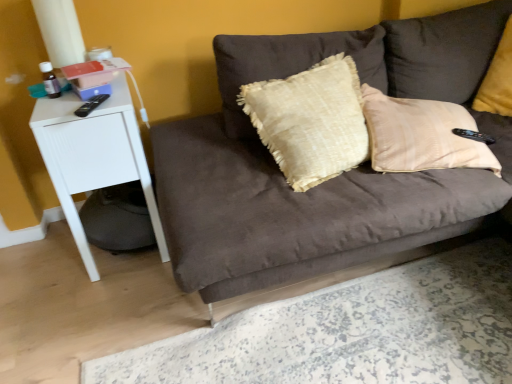
Question: Is suede brown couch at center surrounding white matte side table at left?

Choices:
 (A) yes
 (B) no

Answer: (B)

Question: Considering the relative sizes of suede brown couch at center and white matte side table at left in the image provided, is suede brown couch at center bigger than white matte side table at left?

Choices:
 (A) yes
 (B) no

Answer: (A)

Question: Is suede brown couch at center smaller than white matte side table at left?

Choices:
 (A) no
 (B) yes

Answer: (A)

Question: Is suede brown couch at center taller than white matte side table at left?

Choices:
 (A) yes
 (B) no

Answer: (B)

Question: Is suede brown couch at center oriented away from white matte side table at left?

Choices:
 (A) no
 (B) yes

Answer: (A)

Question: Considering their positions, is suede brown couch at center located in front of or behind white matte side table at left?

Choices:
 (A) front
 (B) behind

Answer: (A)

Question: From a real-world perspective, is suede brown couch at center physically located above or below white matte side table at left?

Choices:
 (A) below
 (B) above

Answer: (B)

Question: Is suede brown couch at center wider or thinner than white matte side table at left?

Choices:
 (A) wide
 (B) thin

Answer: (A)

Question: Is point (181, 279) closer or farther from the camera than point (137, 144)?

Choices:
 (A) farther
 (B) closer

Answer: (B)

Question: Relative to suede brown couch at center, is velvet yellow pillow at upper right in front or behind?

Choices:
 (A) front
 (B) behind

Answer: (B)

Question: Considering the positions of velvet yellow pillow at upper right and suede brown couch at center in the image, is velvet yellow pillow at upper right taller or shorter than suede brown couch at center?

Choices:
 (A) short
 (B) tall

Answer: (A)

Question: Choose the correct answer: Is velvet yellow pillow at upper right inside suede brown couch at center or outside it?

Choices:
 (A) outside
 (B) inside

Answer: (B)

Question: From a real-world perspective, is velvet yellow pillow at upper right positioned above or below suede brown couch at center?

Choices:
 (A) below
 (B) above

Answer: (B)

Question: Based on their positions, is suede brown couch at center located to the left or right of velvet yellow pillow at upper right?

Choices:
 (A) right
 (B) left

Answer: (B)

Question: Considering the positions of suede brown couch at center and velvet yellow pillow at upper right in the image, is suede brown couch at center wider or thinner than velvet yellow pillow at upper right?

Choices:
 (A) wide
 (B) thin

Answer: (A)